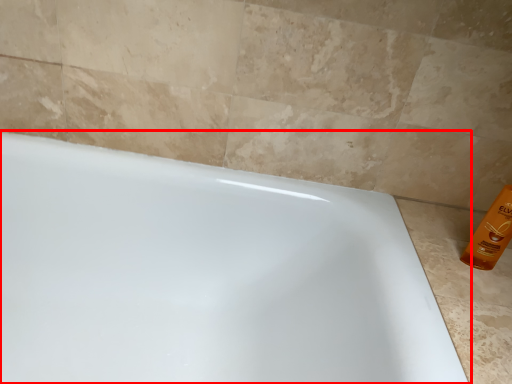
Question: In this image, where is bathtub (annotated by the red box) located relative to cleaning product?

Choices:
 (A) left
 (B) right

Answer: (A)